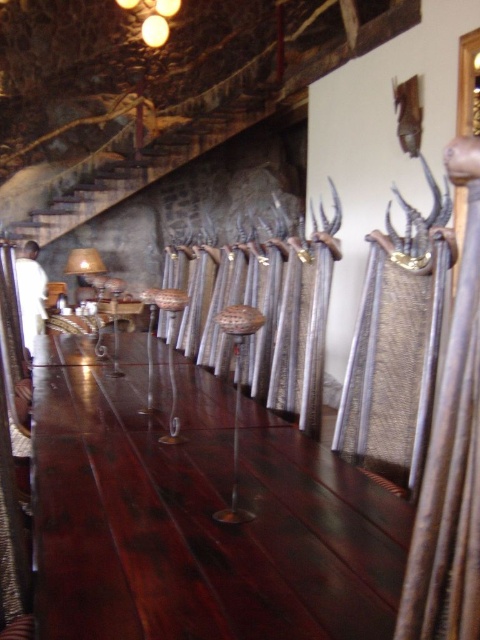
You are standing in the room and want to determine which of the two points, point (41, 573) or point (416, 326), is nearer to you. Based on the scene description, which point is closer?

Point (41, 573) is closer to the viewer than point (416, 326).

You are an interior designer planning to move the metallic polished spears at center closer to the rustic wooden stairs at upper left. Based on their current positions, which direction should you move the spears to align them under the stairs?

The metallic polished spears at center is already located below rustic wooden stairs at upper left, so no movement is needed to align them under the stairs.

You are organizing a display in this space and need to place a large decorative item that requires more space. Which object between the metallic polished spears at center and the metallic mesh sculpture at right should you prioritize placing first?

The metallic polished spears at center should be prioritized since they are larger in size compared to the metallic mesh sculpture at right, requiring more space for placement.